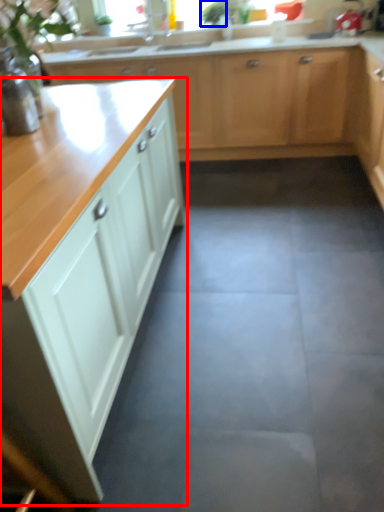
Question: Which object is further to the camera taking this photo, cabinetry (highlighted by a red box) or plant (highlighted by a blue box)?

Choices:
 (A) cabinetry
 (B) plant

Answer: (B)